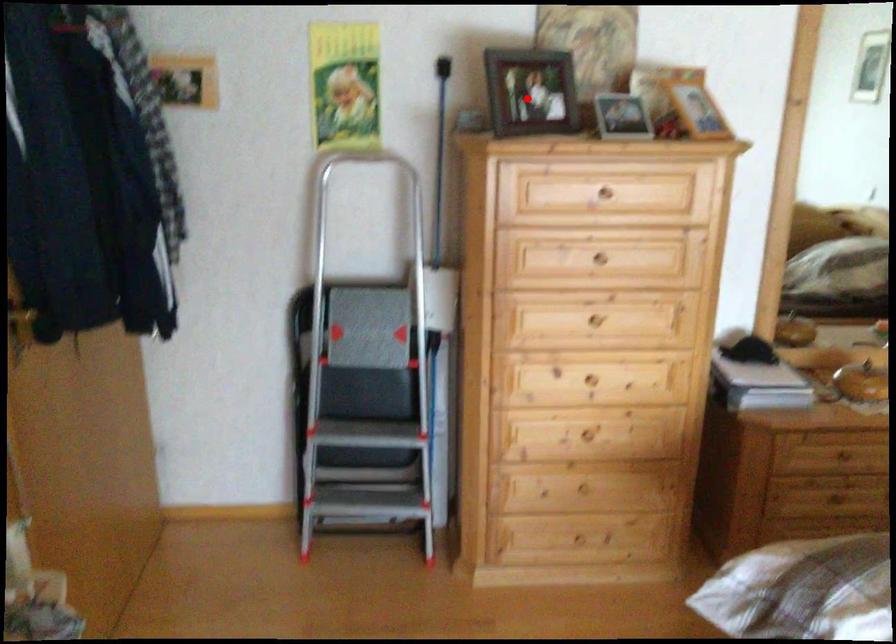
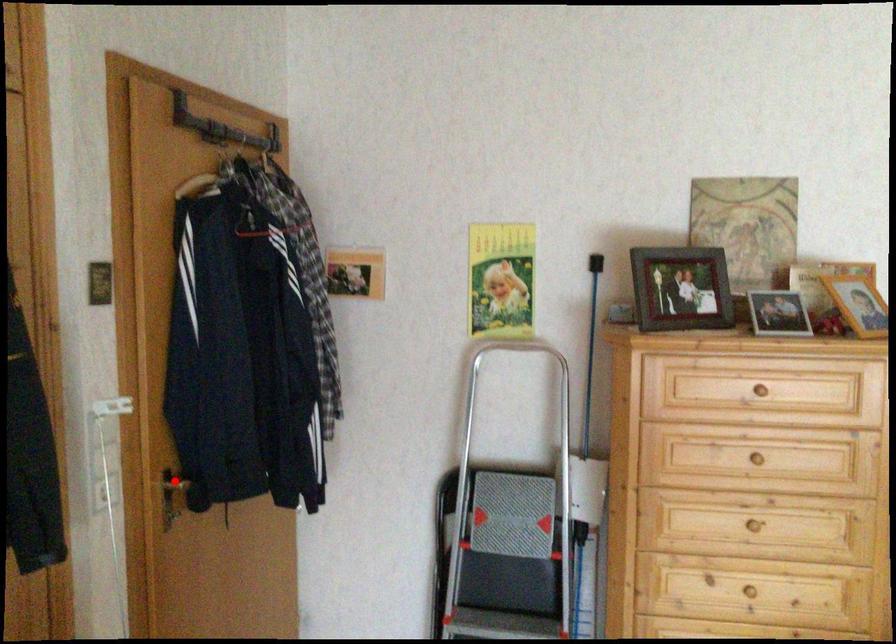
I am providing you with two images of the same scene from different viewpoints. A red point is marked on the first image and another point is marked on the second image. Does the point marked in image1 correspond to the same location as the one in image2?

No